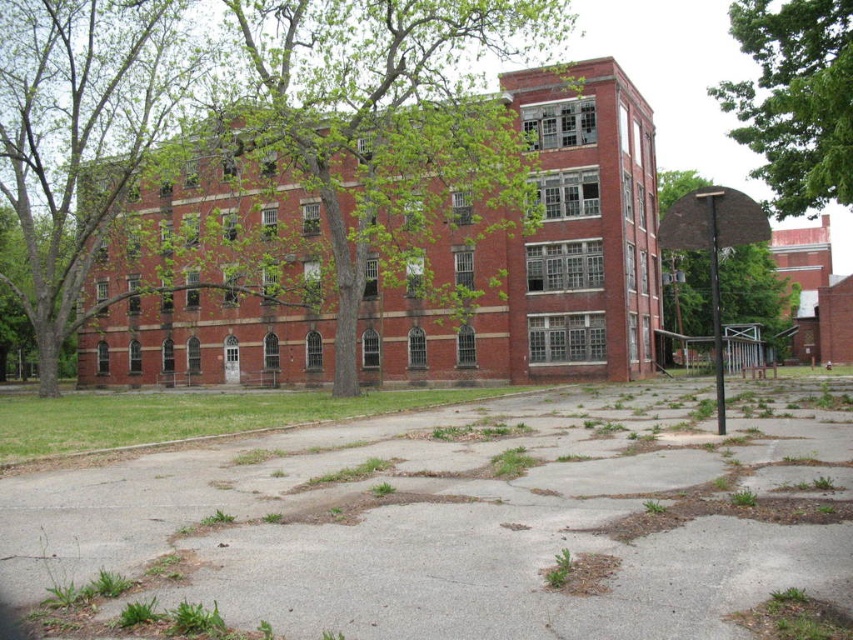
Based on the photo, you are standing in front of the abandoned brick building and want to walk towards the basketball hoop. Which object, the green leafy tree at upper center or the brown textured basketball hoop at center right, will you pass first?

You will pass the brown textured basketball hoop at center right first because it is closer to you than the green leafy tree at upper center, which is further away.

You are standing in front of the abandoned building and notice the green leafy tree at upper center and the brown textured basketball hoop at center right. From your perspective, which object is positioned to the right side?

The green leafy tree at upper center is positioned to the right of the brown textured basketball hoop at center right.